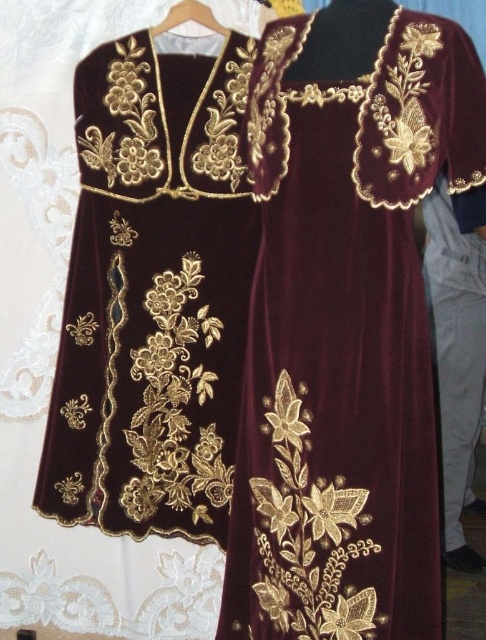
In the scene shown: You are a fashion designer who wants to display two dresses in a store window. The velvet burgundy dress at center and the velvet gold embroidered dress at center must be arranged so that the larger one is placed in the front to attract customers. According to the description, which dress should be placed in front?

The velvet burgundy dress at center has a larger size compared to the velvet gold embroidered dress at center, so it should be placed in front to attract customers.

You are a fashion designer looking at the velvet burgundy dress at center and the wooden hanger at upper center in the image. Which object is positioned to the left side of the other?

The velvet burgundy dress at center is to the right of the wooden hanger at upper center, so the wooden hanger at upper center is positioned to the left side of the velvet burgundy dress at center.